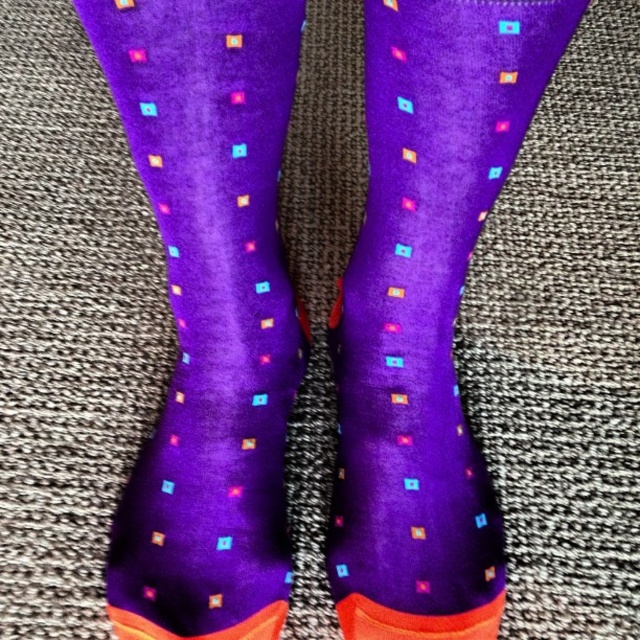
You are trying to decide which pair of socks to wear. You have two options in front of you on the carpet. Both are purple with colorful square patterns. The first is labeled as purple velvet socks at center, and the second is labeled as purple matte socks at center. Which pair is shorter?

The purple velvet socks at center is shorter than the purple matte socks at center.

You are a delivery robot with a 6 inch wide package. You need to place the package between the purple velvet socks at center and the purple matte socks at center. Is there enough space between them to fit the package?

The purple velvet socks at center and purple matte socks at center are 5.69 inches apart. Since the package is 6 inches wide, it is slightly wider than the space between them, so the package cannot fit between them.